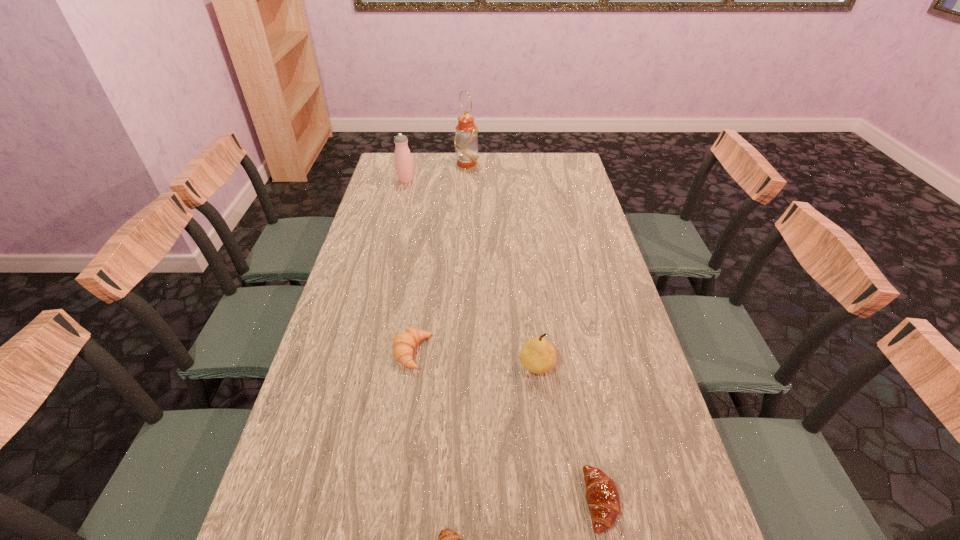
Locate an element on the screen. The height and width of the screenshot is (540, 960). free space between the rightmost object and the farthest object is located at coordinates (534, 333).

Locate an element on the screen. The image size is (960, 540). free point between the rightmost object and the farthest crescent roll is located at coordinates (507, 427).

Choose which object is the nearest neighbor to the oil lamp. Please provide its 2D coordinates. Your answer should be formatted as a tuple, i.e. [(x, y)], where the tuple contains the x and y coordinates of a point satisfying the conditions above.

[(403, 161)]

Identify the location of object that is the fourth closest to the second crescent roll from left to right. (403, 161).

Where is `crescent roll identified as the closest to the second crescent roll from right to left`? crescent roll identified as the closest to the second crescent roll from right to left is located at coordinates pyautogui.click(x=602, y=495).

Locate an element on the screen. crescent roll that stands as the second closest to the rightmost crescent roll is located at coordinates (404, 343).